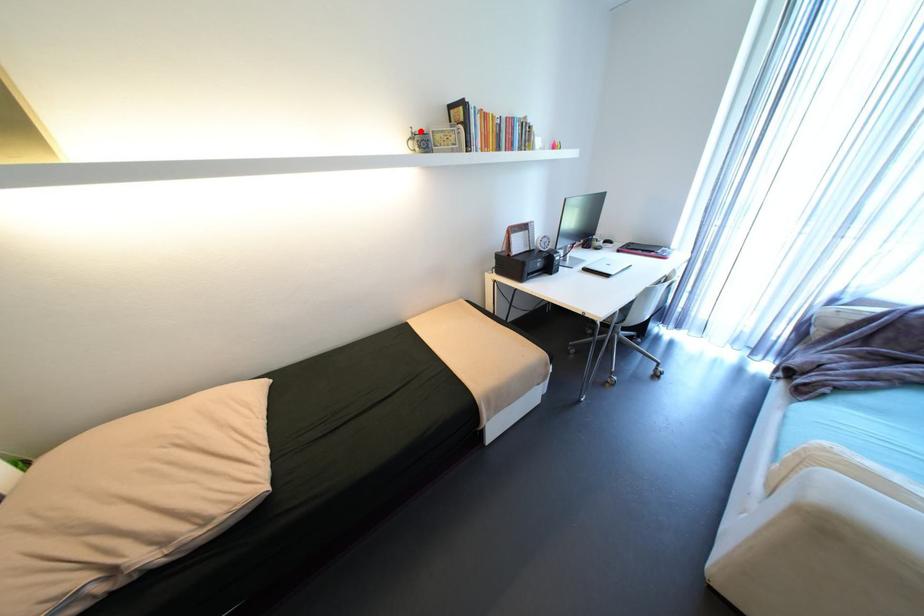
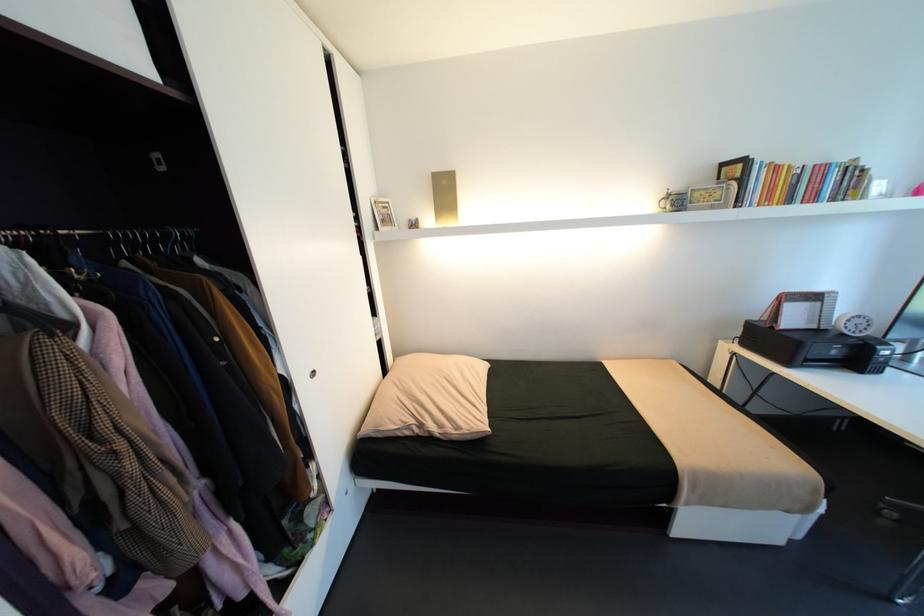
In the second image, find the point that corresponds to the highlighted location in the first image.

(676, 192)